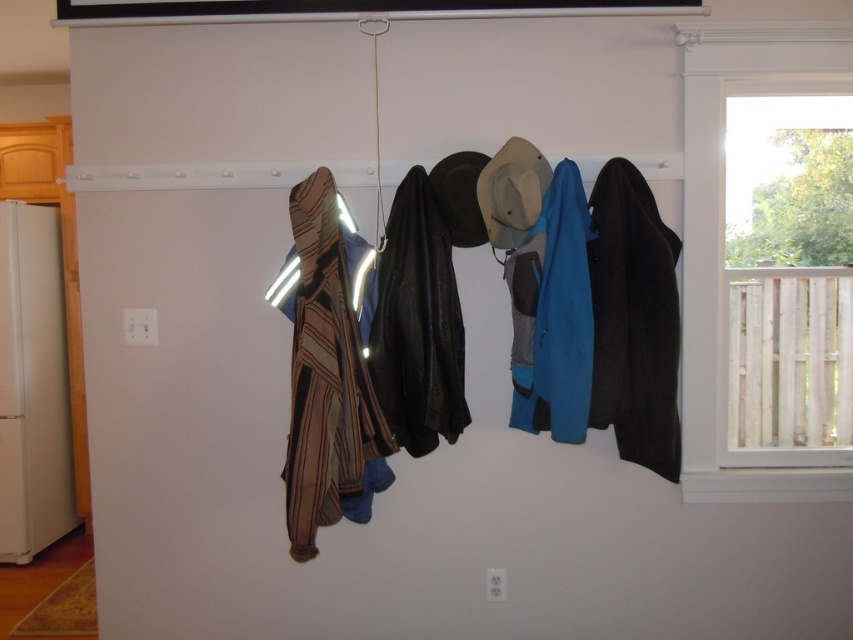
You are standing in front of the coat rack and want to hang a new item. The point you want to hang it at is at coordinates point (x=561, y=314). What is currently occupying that location?

The point (x=561, y=314) is on teal fleece jacket at center, so that location is currently occupied by the teal fleece jacket at center.

You are organizing a coat rack and need to know which item is wider between the striped fabric scarf at left and the leather jacket at center. Can you determine which one is wider?

The striped fabric scarf at left is wider than the leather jacket at center according to the description.

You are a person who wants to hang a new coat that is 3 feet wide on the coat rack. The coat rack has a striped fabric scarf at left and a light blue jacket in the center. Can you hang the new coat between them?

The distance between the striped fabric scarf at left and the light blue jacket in the center is 7.39 feet. Since the new coat is only 3 feet wide, there is enough space to hang it between them.